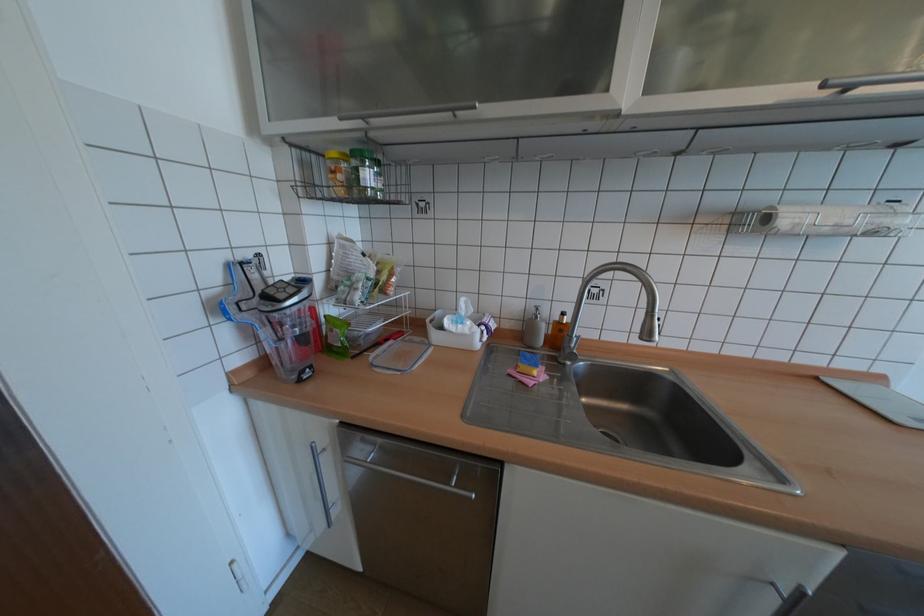
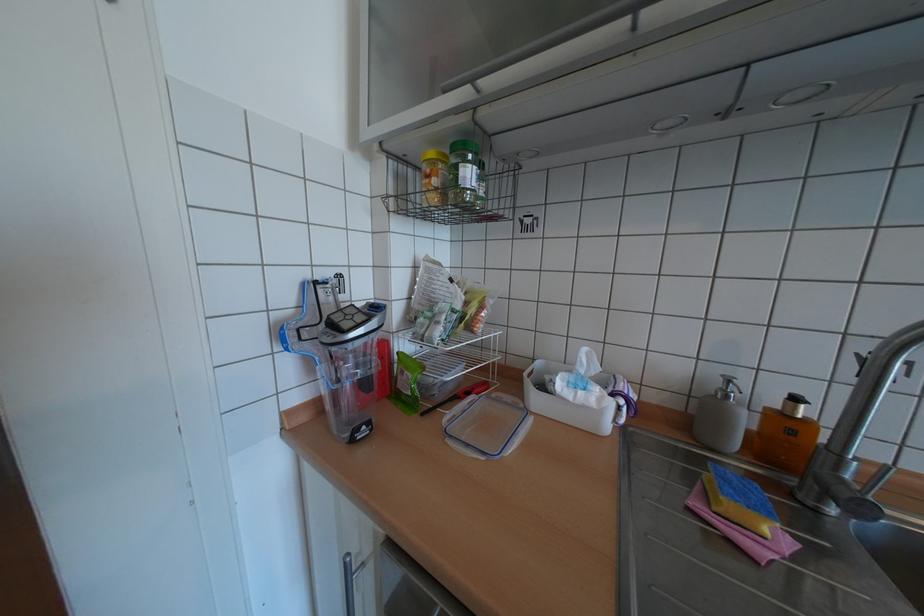
The point at (545, 309) is marked in the first image. Where is the corresponding point in the second image?

(737, 381)